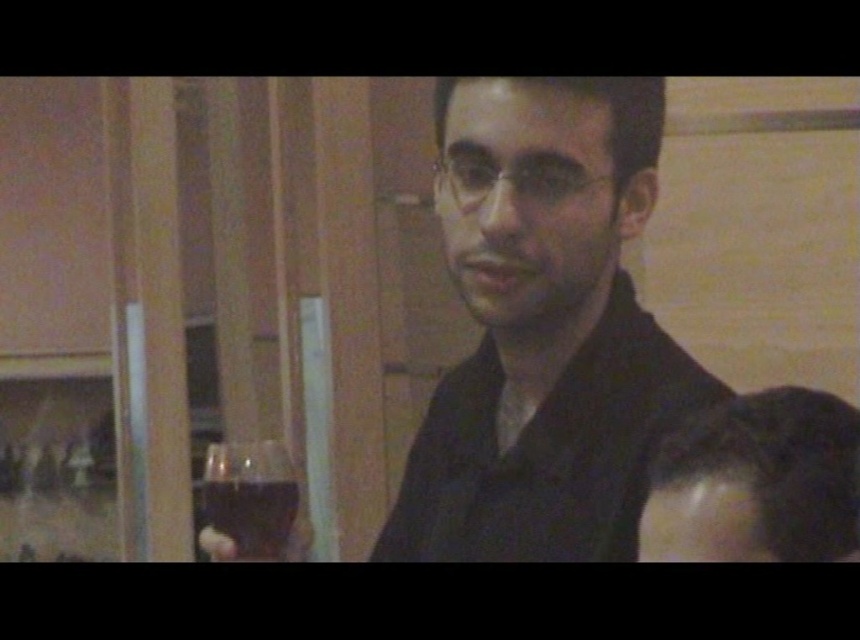
Question: Is matte black shirt at center bigger than transparent glass at left?

Choices:
 (A) yes
 (B) no

Answer: (A)

Question: Considering the real-world distances, which object is farthest from the dark brown hair at lower right?

Choices:
 (A) matte black shirt at center
 (B) transparent glass at left

Answer: (B)

Question: Which point is farther to the camera?

Choices:
 (A) transparent glass at left
 (B) dark brown hair at lower right
 (C) matte black shirt at center

Answer: (A)

Question: Does dark brown hair at lower right have a larger size compared to transparent glass at left?

Choices:
 (A) yes
 (B) no

Answer: (A)

Question: Does dark brown hair at lower right have a lesser width compared to transparent glass at left?

Choices:
 (A) no
 (B) yes

Answer: (A)

Question: Among these points, which one is farthest from the camera?

Choices:
 (A) (707, 385)
 (B) (783, 504)
 (C) (275, 554)

Answer: (C)